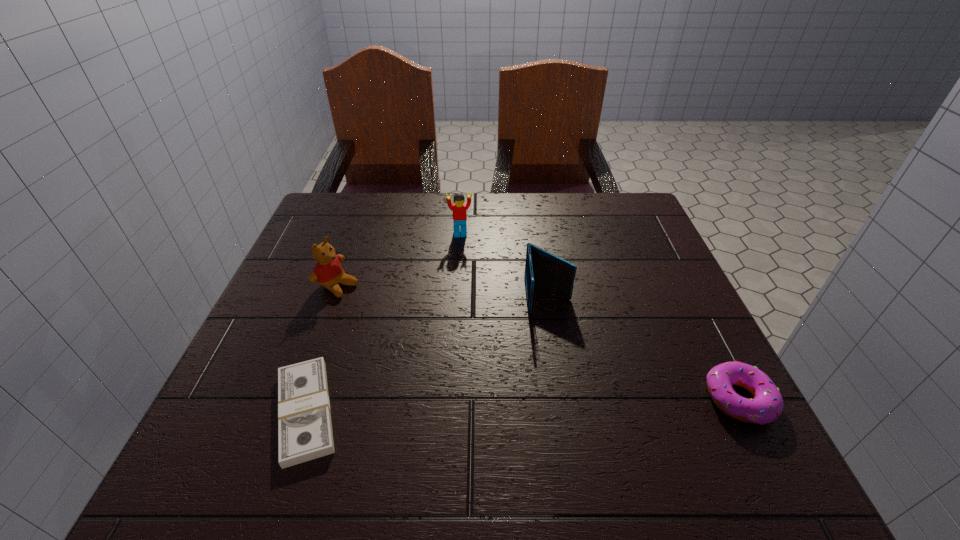
Locate an element on the screen. The image size is (960, 540). dollar is located at coordinates (305, 433).

You are a GUI agent. You are given a task and a screenshot of the screen. Output one action in this format:
    pyautogui.click(x=<x>, y=<y>)
    Task: Click on the rightmost object
    The height and width of the screenshot is (540, 960).
    Given the screenshot: What is the action you would take?
    pyautogui.click(x=766, y=406)

What are the coordinates of `doughnut` in the screenshot? It's located at (766, 406).

Find the location of a particular element. This screenshot has height=540, width=960. the farthest object is located at coordinates (459, 208).

Locate an element on the screen. Image resolution: width=960 pixels, height=540 pixels. Lego is located at coordinates (459, 208).

Find the location of a particular element. The image size is (960, 540). teddy bear is located at coordinates (328, 272).

Image resolution: width=960 pixels, height=540 pixels. What are the coordinates of `the third tallest object` in the screenshot? It's located at (542, 268).

Find the location of a particular element. The height and width of the screenshot is (540, 960). the second object from right to left is located at coordinates (542, 268).

Identify the location of free space located 0.050m on the back of the shortest object. (329, 343).

At what (x,y) coordinates should I click in order to perform the action: click on blank space located on the left of the doughnut. Please return your answer as a coordinate pair (x, y). This screenshot has height=540, width=960. Looking at the image, I should click on (581, 399).